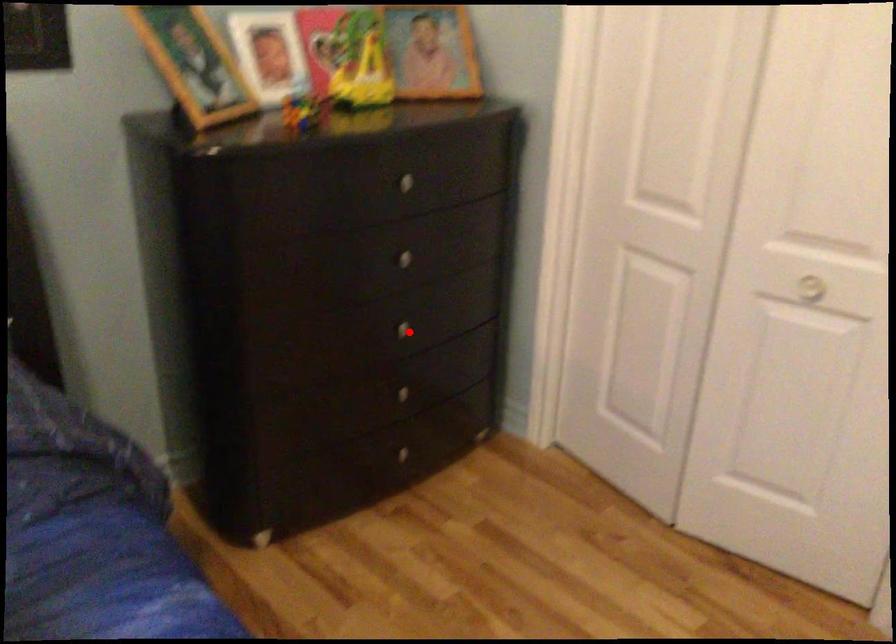
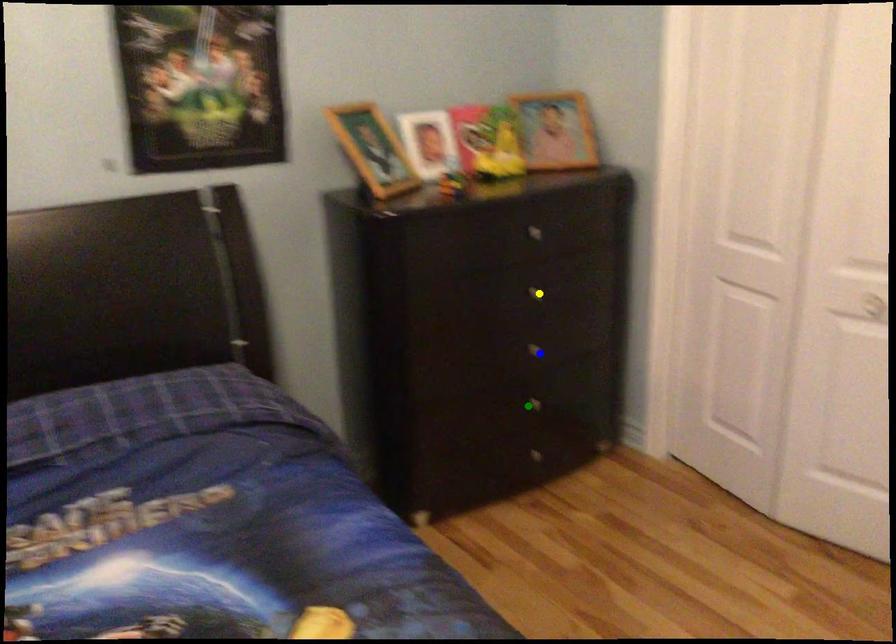
Question: I am providing you with two images of the same scene from different viewpoints. A red point is marked on the first image. You are given multiple points on the second image. In image 2, which mark is for the same physical point as the one in image 1?

Choices:
 (A) yellow point
 (B) blue point
 (C) green point

Answer: (B)